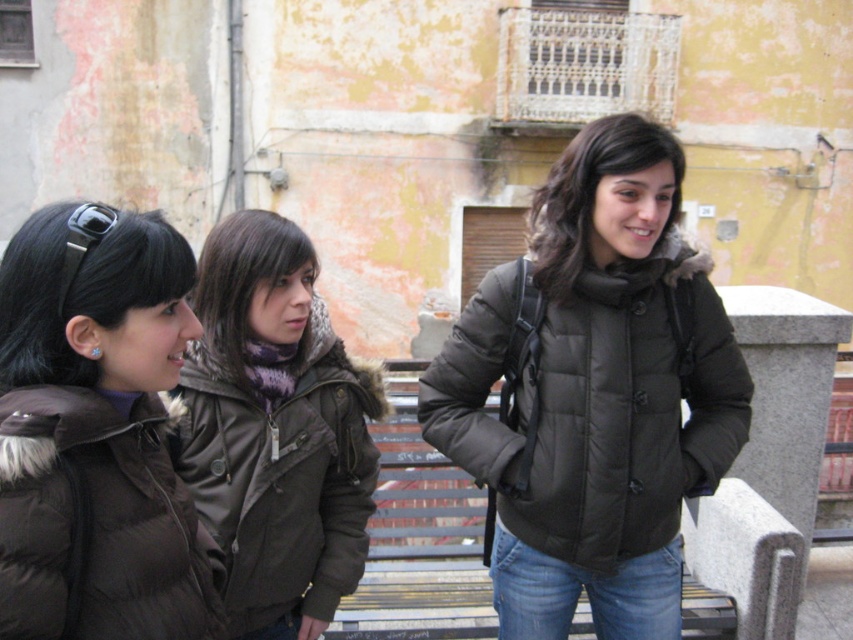
Does matte brown jacket at center have a greater width compared to black down jacket at left?

Yes, matte brown jacket at center is wider than black down jacket at left.

Which of these two, matte brown jacket at center or black down jacket at left, stands shorter?

black down jacket at left is shorter.

You are a GUI agent. You are given a task and a screenshot of the screen. Output one action in this format:
    pyautogui.click(x=<x>, y=<y>)
    Task: Click on the matte brown jacket at center
    The width and height of the screenshot is (853, 640).
    Given the screenshot: What is the action you would take?
    pyautogui.click(x=276, y=429)

Who is shorter, matte brown jacket at center or matte black hair at left?

With less height is matte black hair at left.

Can you confirm if matte brown jacket at center is positioned to the right of matte black hair at left?

Indeed, matte brown jacket at center is positioned on the right side of matte black hair at left.

Is point (218, 461) closer to viewer compared to point (155, 264)?

No, (218, 461) is further to viewer.

In order to click on matte brown jacket at center in this screenshot , I will do `click(276, 429)`.

Is black down jacket at left positioned before matte black hair at left?

Yes, black down jacket at left is in front of matte black hair at left.

Is black down jacket at left taller than matte black hair at left?

Yes.

Where is `black down jacket at left`? black down jacket at left is located at coordinates tap(99, 522).